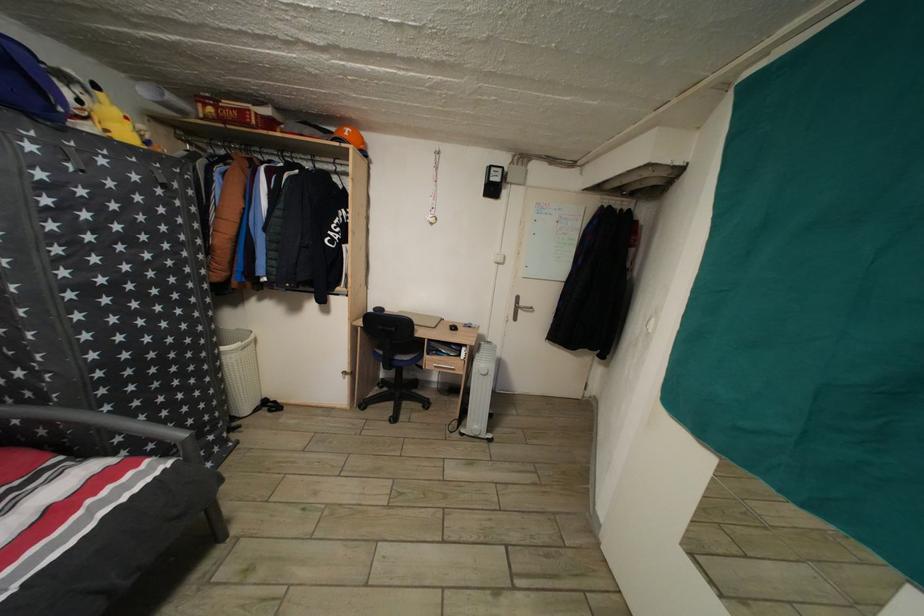
The height and width of the screenshot is (616, 924). I want to click on desk drawer handle, so click(441, 365).